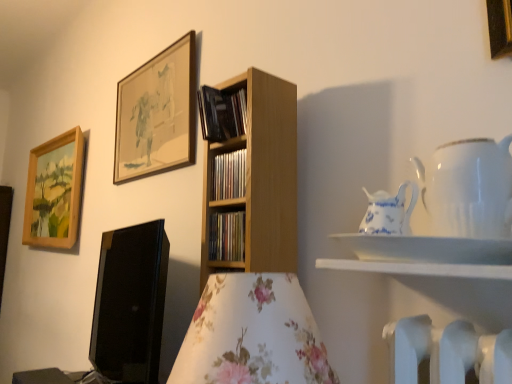
Question: Should I look upward or downward to see wooden framed artwork at upper center, acting as the second picture frame starting from the back?

Choices:
 (A) down
 (B) up

Answer: (B)

Question: From a real-world perspective, is wooden framed artwork at upper center, acting as the second picture frame starting from the back, over blue and white porcelain pitcher at upper right, which appears as the 2th tableware when viewed from the right?

Choices:
 (A) yes
 (B) no

Answer: (A)

Question: Is wooden framed artwork at upper center, acting as the second picture frame starting from the back, not inside blue and white porcelain pitcher at upper right, the first tableware in the left-to-right sequence?

Choices:
 (A) yes
 (B) no

Answer: (A)

Question: Does wooden framed artwork at upper center, which appears as the second picture frame when viewed from the front, have a greater width compared to blue and white porcelain pitcher at upper right, which appears as the 2th tableware when viewed from the right?

Choices:
 (A) yes
 (B) no

Answer: (B)

Question: Does wooden framed artwork at upper center, arranged as the second picture frame when viewed from the right, have a larger size compared to blue and white porcelain pitcher at upper right, the first tableware in the left-to-right sequence?

Choices:
 (A) no
 (B) yes

Answer: (B)

Question: Is wooden framed artwork at upper center, which appears as the second picture frame when viewed from the front, to the left of blue and white porcelain pitcher at upper right, which appears as the 2th tableware when viewed from the right, from the viewer's perspective?

Choices:
 (A) yes
 (B) no

Answer: (A)

Question: Would you say wooden framed artwork at upper center, which appears as the second picture frame when viewed from the front, is a long distance from blue and white porcelain pitcher at upper right, the first tableware in the left-to-right sequence?

Choices:
 (A) no
 (B) yes

Answer: (B)

Question: Can you confirm if wooden picture frame at upper left, which is counted as the 3th picture frame, starting from the right, is shorter than gold metallic picture frame at upper right, marked as the 1th picture frame in a front-to-back arrangement?

Choices:
 (A) yes
 (B) no

Answer: (B)

Question: Can we say wooden picture frame at upper left, the 3th picture frame viewed from the front, lies outside gold metallic picture frame at upper right, the 1th picture frame from the right?

Choices:
 (A) yes
 (B) no

Answer: (A)

Question: From a real-world perspective, is wooden picture frame at upper left, the 1th picture frame in the back-to-front sequence, under gold metallic picture frame at upper right, marked as the 1th picture frame in a front-to-back arrangement?

Choices:
 (A) no
 (B) yes

Answer: (B)

Question: Does wooden picture frame at upper left, the 3th picture frame viewed from the front, appear on the right side of gold metallic picture frame at upper right, which ranks as the 3th picture frame in back-to-front order?

Choices:
 (A) yes
 (B) no

Answer: (B)

Question: From the image's perspective, is wooden picture frame at upper left, the 3th picture frame viewed from the front, over gold metallic picture frame at upper right, the 1th picture frame from the right?

Choices:
 (A) no
 (B) yes

Answer: (A)

Question: From a real-world perspective, does wooden picture frame at upper left, which is the 1th picture frame in left-to-right order, stand above gold metallic picture frame at upper right, marked as the 1th picture frame in a front-to-back arrangement?

Choices:
 (A) yes
 (B) no

Answer: (B)

Question: Is blue and white porcelain pitcher at upper right, which appears as the 2th tableware when viewed from the right, not near wooden framed artwork at upper center, the 2th picture frame positioned from the left?

Choices:
 (A) no
 (B) yes

Answer: (B)